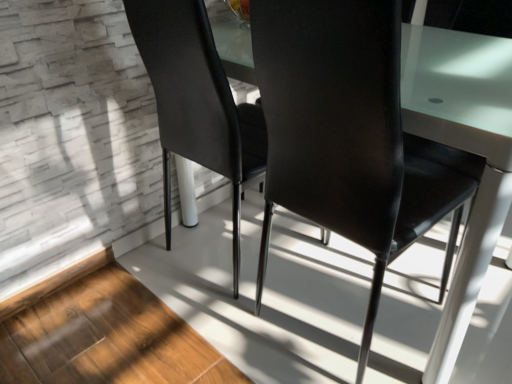
The image size is (512, 384). What are the coordinates of `matte black chair at center, the 1th chair in the right-to-left sequence` in the screenshot? It's located at (347, 134).

The image size is (512, 384). Describe the element at coordinates (347, 134) in the screenshot. I see `matte black chair at center, the 1th chair in the right-to-left sequence` at that location.

What is the approximate width of matte black chair at center, the 1th chair in the right-to-left sequence?

The width of matte black chair at center, the 1th chair in the right-to-left sequence, is 22.03 inches.

Where is `matte black chair at center, arranged as the second chair when viewed from the right`? Image resolution: width=512 pixels, height=384 pixels. matte black chair at center, arranged as the second chair when viewed from the right is located at coordinates (197, 102).

What do you see at coordinates (197, 102) in the screenshot?
I see `matte black chair at center, the 1th chair in the left-to-right sequence` at bounding box center [197, 102].

Where is `matte black chair at center, the 1th chair in the right-to-left sequence`? matte black chair at center, the 1th chair in the right-to-left sequence is located at coordinates (347, 134).

Is matte black chair at center, arranged as the second chair when viewed from the left, to the left or to the right of matte black chair at center, arranged as the second chair when viewed from the right, in the image?

matte black chair at center, arranged as the second chair when viewed from the left, is to the right of matte black chair at center, arranged as the second chair when viewed from the right.

Which object is more forward, matte black chair at center, arranged as the second chair when viewed from the left, or matte black chair at center, arranged as the second chair when viewed from the right?

matte black chair at center, arranged as the second chair when viewed from the left, is closer to the camera.

Which point is more distant from viewer, (x=277, y=136) or (x=183, y=93)?

The point (x=183, y=93) is behind.

From the image's perspective, is matte black chair at center, the 1th chair in the right-to-left sequence, located above or below matte black chair at center, the 1th chair in the left-to-right sequence?

Clearly, from the image's perspective, matte black chair at center, the 1th chair in the right-to-left sequence, is below matte black chair at center, the 1th chair in the left-to-right sequence.

From the picture: From a real-world perspective, is matte black chair at center, arranged as the second chair when viewed from the left, positioned under matte black chair at center, the 1th chair in the left-to-right sequence, based on gravity?

Actually, matte black chair at center, arranged as the second chair when viewed from the left, is physically above matte black chair at center, the 1th chair in the left-to-right sequence, in the real world.

Based on the photo, considering the relative sizes of matte black chair at center, the 1th chair in the right-to-left sequence, and matte black chair at center, arranged as the second chair when viewed from the right, in the image provided, is matte black chair at center, the 1th chair in the right-to-left sequence, wider than matte black chair at center, arranged as the second chair when viewed from the right,?

Yes.

Is matte black chair at center, the 1th chair in the right-to-left sequence, shorter than matte black chair at center, the 1th chair in the left-to-right sequence?

No, matte black chair at center, the 1th chair in the right-to-left sequence, is not shorter than matte black chair at center, the 1th chair in the left-to-right sequence.

In terms of size, does matte black chair at center, the 1th chair in the right-to-left sequence, appear bigger or smaller than matte black chair at center, arranged as the second chair when viewed from the right?

Clearly, matte black chair at center, the 1th chair in the right-to-left sequence, is larger in size than matte black chair at center, arranged as the second chair when viewed from the right.

Is matte black chair at center, the 1th chair in the right-to-left sequence, inside the boundaries of matte black chair at center, the 1th chair in the left-to-right sequence, or outside?

matte black chair at center, the 1th chair in the right-to-left sequence, cannot be found inside matte black chair at center, the 1th chair in the left-to-right sequence.

Is the surface of matte black chair at center, arranged as the second chair when viewed from the left, in direct contact with matte black chair at center, arranged as the second chair when viewed from the right?

No, matte black chair at center, arranged as the second chair when viewed from the left, is not next to matte black chair at center, arranged as the second chair when viewed from the right.

In the scene shown: Is matte black chair at center, arranged as the second chair when viewed from the left, oriented away from matte black chair at center, arranged as the second chair when viewed from the right?

matte black chair at center, arranged as the second chair when viewed from the left, is not turned away from matte black chair at center, arranged as the second chair when viewed from the right.

How many degrees apart are the facing directions of matte black chair at center, arranged as the second chair when viewed from the left, and matte black chair at center, arranged as the second chair when viewed from the right?

They differ by 1.46 degrees in their facing directions.

Identify the location of chair located on the right of matte black chair at center, the 1th chair in the left-to-right sequence. (347, 134).

Can you confirm if matte black chair at center, arranged as the second chair when viewed from the right, is positioned to the left of matte black chair at center, the 1th chair in the right-to-left sequence?

Indeed, matte black chair at center, arranged as the second chair when viewed from the right, is positioned on the left side of matte black chair at center, the 1th chair in the right-to-left sequence.

Based on the photo, which object is closer to the camera taking this photo, matte black chair at center, arranged as the second chair when viewed from the right, or matte black chair at center, arranged as the second chair when viewed from the left?

matte black chair at center, arranged as the second chair when viewed from the left, is more forward.

Considering the positions of point (218, 67) and point (339, 96), is point (218, 67) closer or farther from the camera than point (339, 96)?

Clearly, point (218, 67) is more distant from the camera than point (339, 96).

From the image's perspective, which object appears higher, matte black chair at center, the 1th chair in the left-to-right sequence, or matte black chair at center, arranged as the second chair when viewed from the left?

From the image's view, matte black chair at center, the 1th chair in the left-to-right sequence, is above.

From a real-world perspective, between matte black chair at center, the 1th chair in the left-to-right sequence, and matte black chair at center, the 1th chair in the right-to-left sequence, who is vertically lower?

matte black chair at center, the 1th chair in the left-to-right sequence.

Is matte black chair at center, arranged as the second chair when viewed from the right, wider than matte black chair at center, arranged as the second chair when viewed from the left?

In fact, matte black chair at center, arranged as the second chair when viewed from the right, might be narrower than matte black chair at center, arranged as the second chair when viewed from the left.

Is matte black chair at center, arranged as the second chair when viewed from the right, taller than matte black chair at center, the 1th chair in the right-to-left sequence?

Incorrect, the height of matte black chair at center, arranged as the second chair when viewed from the right, is not larger of that of matte black chair at center, the 1th chair in the right-to-left sequence.

Based on their sizes in the image, would you say matte black chair at center, arranged as the second chair when viewed from the right, is bigger or smaller than matte black chair at center, arranged as the second chair when viewed from the left?

In the image, matte black chair at center, arranged as the second chair when viewed from the right, appears to be smaller than matte black chair at center, arranged as the second chair when viewed from the left.

Based on the photo, is matte black chair at center, arranged as the second chair when viewed from the left, a part of matte black chair at center, arranged as the second chair when viewed from the right?

No.

Looking at this image, is matte black chair at center, the 1th chair in the left-to-right sequence, positioned far away from matte black chair at center, the 1th chair in the right-to-left sequence?

No, there isn't a large distance between matte black chair at center, the 1th chair in the left-to-right sequence, and matte black chair at center, the 1th chair in the right-to-left sequence.

Is matte black chair at center, the 1th chair in the left-to-right sequence, facing away from matte black chair at center, arranged as the second chair when viewed from the left?

No, matte black chair at center, the 1th chair in the left-to-right sequence, is not facing the opposite direction of matte black chair at center, arranged as the second chair when viewed from the left.

Find the location of a particular element. The image size is (512, 384). chair lying below the matte black chair at center, arranged as the second chair when viewed from the right (from the image's perspective) is located at coordinates (347, 134).

This screenshot has height=384, width=512. In the image, there is a matte black chair at center, the 1th chair in the right-to-left sequence. Find the location of `chair above it (from the image's perspective)`. chair above it (from the image's perspective) is located at coordinates (197, 102).

Locate an element on the screen. The image size is (512, 384). chair below the matte black chair at center, the 1th chair in the left-to-right sequence (from the image's perspective) is located at coordinates (347, 134).